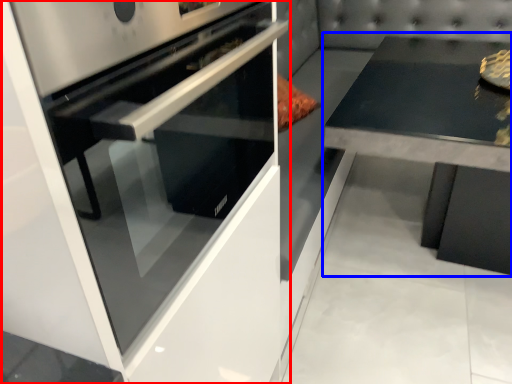
Question: Which object is further to the camera taking this photo, home appliance (highlighted by a red box) or round table (highlighted by a blue box)?

Choices:
 (A) home appliance
 (B) round table

Answer: (B)